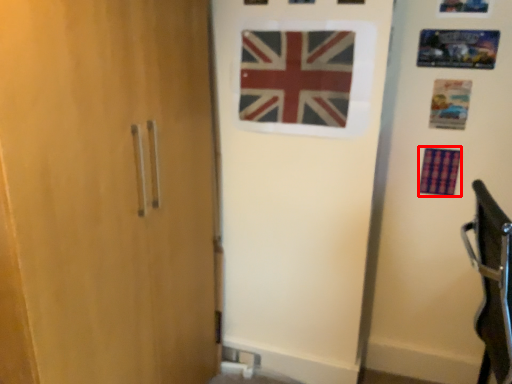
Question: Considering the relative positions of flag (annotated by the red box) and flag in the image provided, where is flag (annotated by the red box) located with respect to the staircase?

Choices:
 (A) right
 (B) left

Answer: (A)